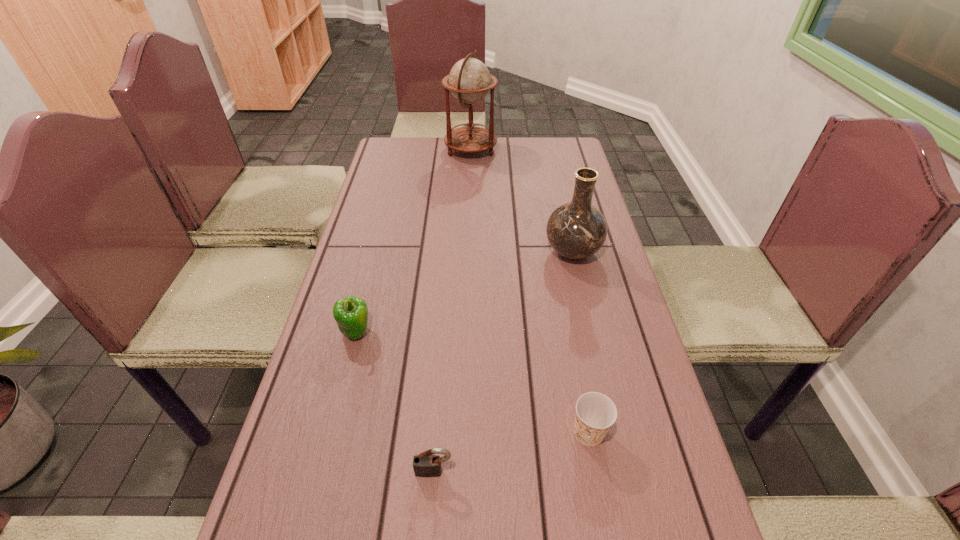
Find the location of a particular element. free location located 0.100m on the right of the third nearest object is located at coordinates (415, 332).

Identify the location of vacant space located 0.190m on the back of the Dixie cup. Image resolution: width=960 pixels, height=540 pixels. (571, 340).

Where is `vacant space located with the keyhole on the front of the padlock`? This screenshot has width=960, height=540. vacant space located with the keyhole on the front of the padlock is located at coordinates (430, 526).

Identify the location of object located in the far edge section of the desktop. (469, 80).

Identify the location of object located in the left edge section of the desktop. Image resolution: width=960 pixels, height=540 pixels. (351, 313).

I want to click on vase that is at the right edge, so click(x=576, y=230).

Identify the location of Dixie cup that is at the right edge. This screenshot has width=960, height=540. (595, 413).

The height and width of the screenshot is (540, 960). I want to click on vacant space at the far edge of the desktop, so click(438, 152).

The height and width of the screenshot is (540, 960). I want to click on blank area at the left edge, so click(x=401, y=250).

Locate an element on the screen. The image size is (960, 540). free space at the right edge is located at coordinates (620, 367).